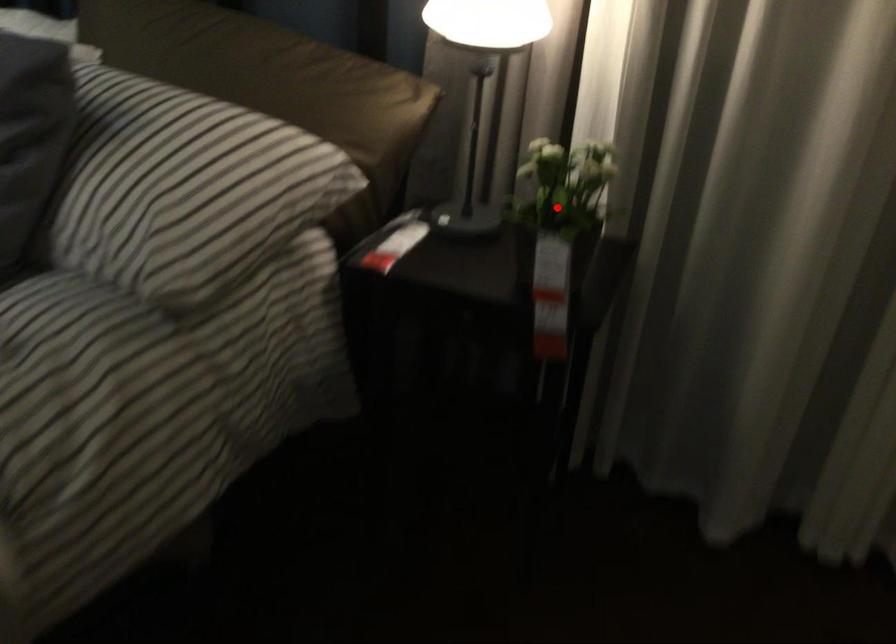
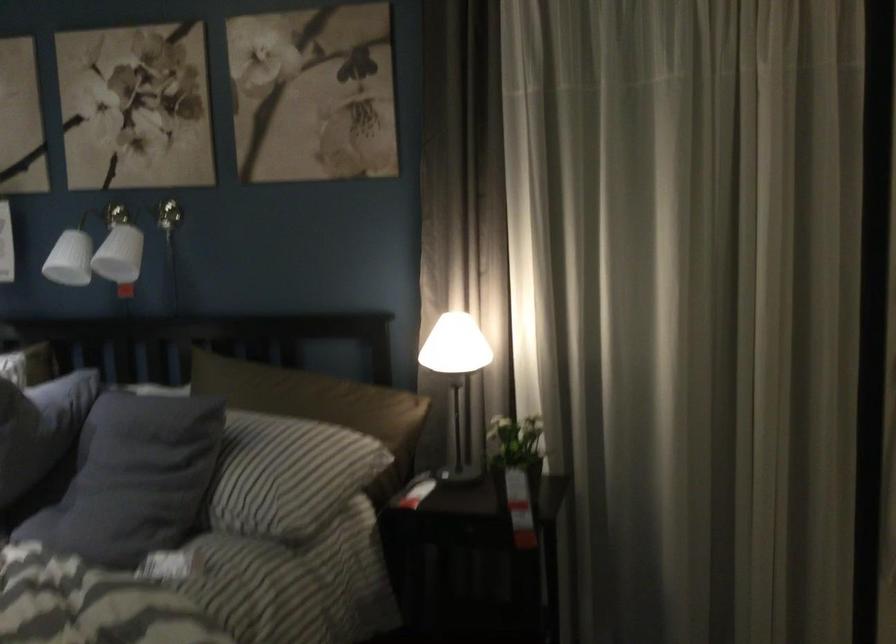
Locate, in the second image, the point that corresponds to the highlighted location in the first image.

(515, 451)